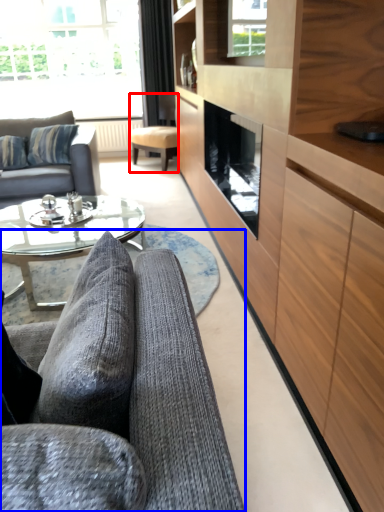
Question: Which object is further to the camera taking this photo, chair (highlighted by a red box) or studio couch (highlighted by a blue box)?

Choices:
 (A) chair
 (B) studio couch

Answer: (A)